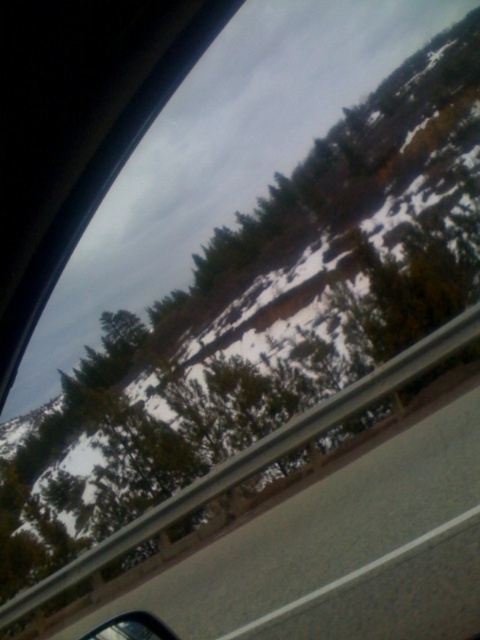
You are a passenger in a car and you see the gray concrete highway at lower center and the glossy metallic car mirror at lower left. Which object is closer to the left side of the car?

The glossy metallic car mirror at lower left is closer to the left side of the car because the gray concrete highway at lower center is positioned to its left side.

Based on the photo, you are driving a car and want to check if the glossy metallic car mirror at lower left can block your view of the gray concrete highway at lower center. Based on their heights, will the mirror block your view of the highway?

The gray concrete highway at lower center is taller than the glossy metallic car mirror at lower left, so the mirror will not block your view of the highway.

You are driving a car and want to check your blind spot. You have two objects in your view, the glossy metallic car mirror at lower left and the gray concrete highway at lower center. Which object is closer to you?

The glossy metallic car mirror at lower left is behind the gray concrete highway at lower center, so the gray concrete highway at lower center is closer to you.